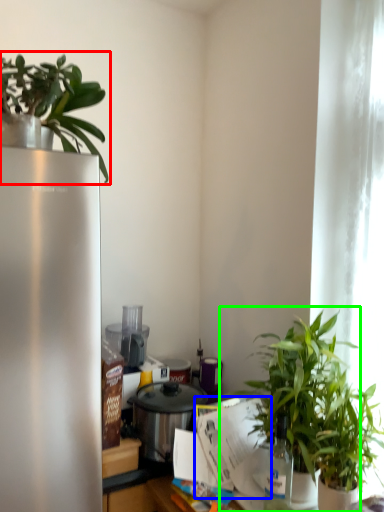
Question: Considering the real-world distances, which object is closest to houseplant (highlighted by a red box)? paper (highlighted by a blue box) or houseplant (highlighted by a green box).

Choices:
 (A) paper
 (B) houseplant

Answer: (B)